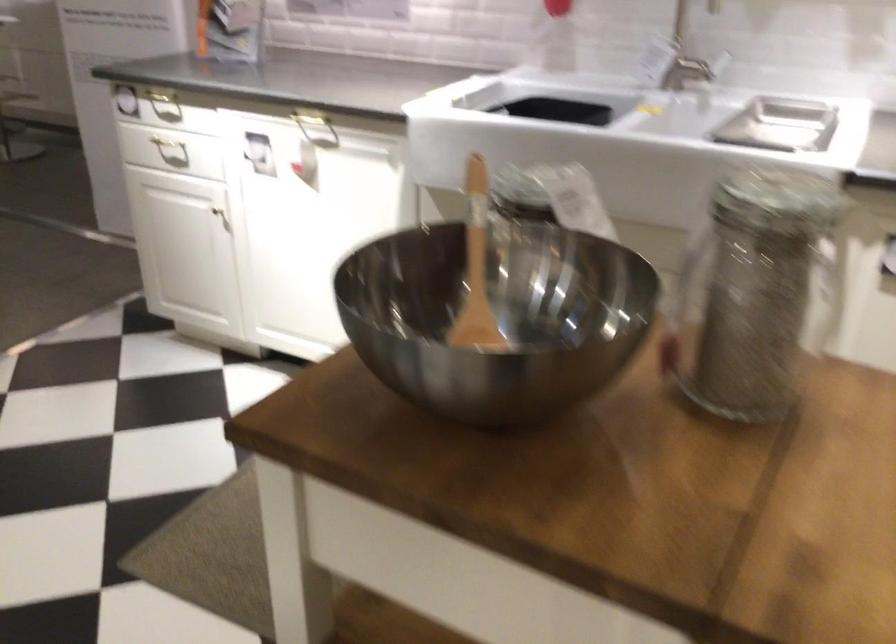
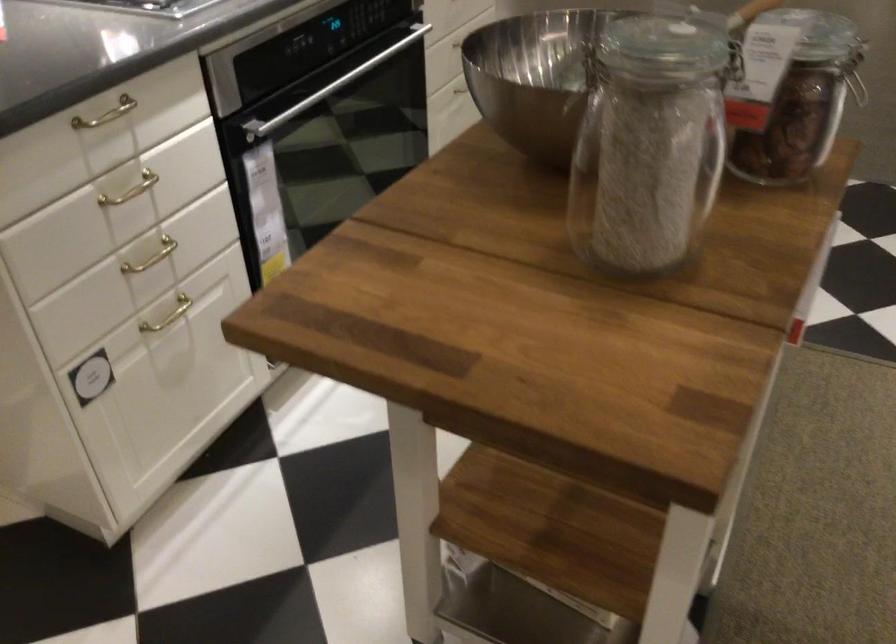
Locate, in the second image, the point that corresponds to point (350, 365) in the first image.

(535, 77)